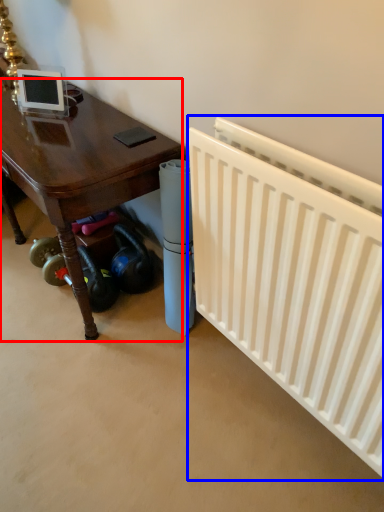
Question: Among these objects, which one is farthest to the camera, table (highlighted by a red box) or radiator (highlighted by a blue box)?

Choices:
 (A) table
 (B) radiator

Answer: (A)